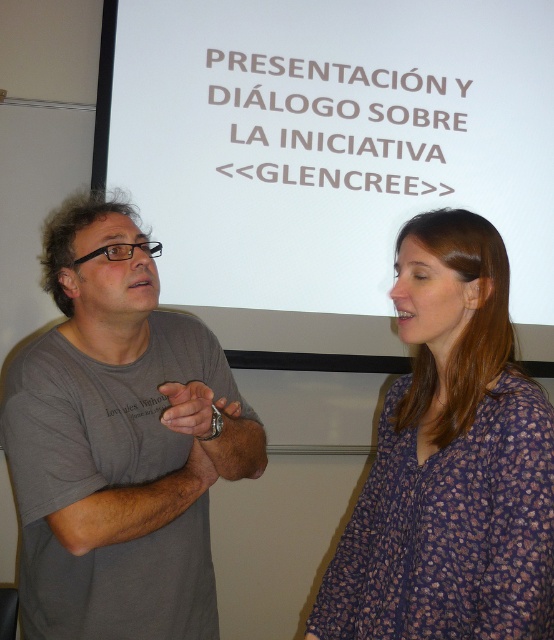
What is the coordinate of the white matte projection screen at upper center?

The white matte projection screen at upper center is located at coordinate point (326, 140).